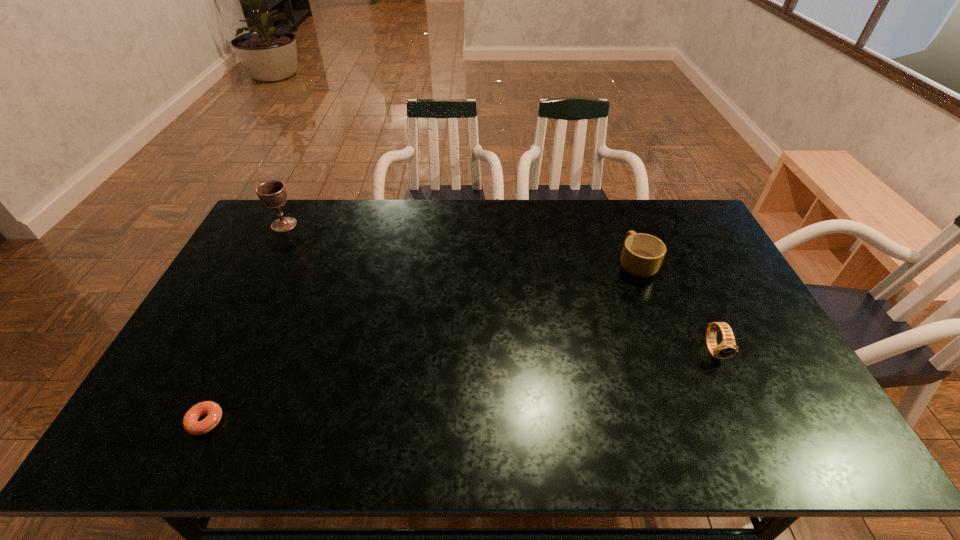
This screenshot has height=540, width=960. I want to click on vacant space that is in between the shortest object and the chalice, so click(245, 323).

Identify the location of vacant space that is in between the mug and the nearest object. The height and width of the screenshot is (540, 960). (421, 342).

Where is `empty space that is in between the watch and the mug`? empty space that is in between the watch and the mug is located at coordinates (675, 307).

What are the coordinates of `free point between the second nearest object and the chalice` in the screenshot? It's located at (499, 287).

Where is `vacant area that lies between the third object from left to right and the shortest object`? This screenshot has width=960, height=540. vacant area that lies between the third object from left to right and the shortest object is located at coordinates (421, 342).

This screenshot has width=960, height=540. Identify the location of free space between the chalice and the shortest object. (245, 323).

Locate which object is the closest to the second farthest object. Please provide its 2D coordinates. Your answer should be formatted as a tuple, i.e. [(x, y)], where the tuple contains the x and y coordinates of a point satisfying the conditions above.

[(727, 348)]

Locate an element on the screen. The width and height of the screenshot is (960, 540). object that is the closest to the nearest object is located at coordinates coord(273,194).

Where is `vacant space that satisfies the following two spatial constraints: 1. on the front side of the doughnut; 2. on the left side of the tallest object`? The height and width of the screenshot is (540, 960). vacant space that satisfies the following two spatial constraints: 1. on the front side of the doughnut; 2. on the left side of the tallest object is located at coordinates (181, 421).